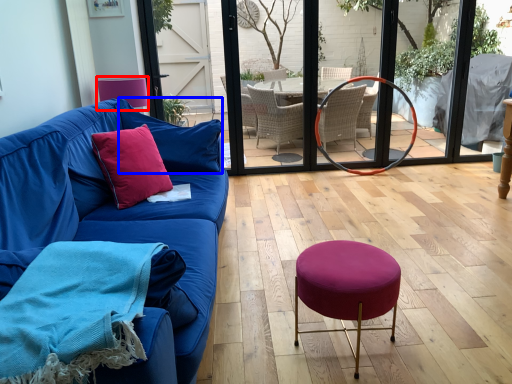
Question: Among these objects, which one is farthest to the camera, armchair (highlighted by a red box) or pillow (highlighted by a blue box)?

Choices:
 (A) armchair
 (B) pillow

Answer: (A)